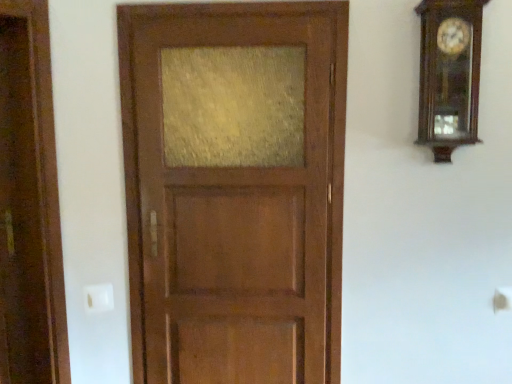
Question: Can you confirm if satin wood door at center is shorter than wooden grandfather clock at upper right?

Choices:
 (A) no
 (B) yes

Answer: (A)

Question: Does satin wood door at center come behind wooden grandfather clock at upper right?

Choices:
 (A) no
 (B) yes

Answer: (B)

Question: Is satin wood door at center in front of wooden grandfather clock at upper right?

Choices:
 (A) no
 (B) yes

Answer: (A)

Question: Does satin wood door at center have a smaller size compared to wooden grandfather clock at upper right?

Choices:
 (A) yes
 (B) no

Answer: (B)

Question: Does satin wood door at center have a lesser width compared to wooden grandfather clock at upper right?

Choices:
 (A) yes
 (B) no

Answer: (A)

Question: From a real-world perspective, is satin wood door at center over wooden grandfather clock at upper right?

Choices:
 (A) no
 (B) yes

Answer: (A)

Question: Is wooden grandfather clock at upper right surrounding satin wood door at center?

Choices:
 (A) no
 (B) yes

Answer: (A)

Question: Could you tell me if wooden grandfather clock at upper right is facing satin wood door at center?

Choices:
 (A) no
 (B) yes

Answer: (A)

Question: From the image's perspective, is wooden grandfather clock at upper right located beneath satin wood door at center?

Choices:
 (A) yes
 (B) no

Answer: (B)

Question: Is wooden grandfather clock at upper right outside satin wood door at center?

Choices:
 (A) no
 (B) yes

Answer: (B)

Question: Considering the relative sizes of wooden grandfather clock at upper right and satin wood door at center in the image provided, is wooden grandfather clock at upper right taller than satin wood door at center?

Choices:
 (A) no
 (B) yes

Answer: (A)

Question: Is wooden grandfather clock at upper right to the left of satin wood door at center from the viewer's perspective?

Choices:
 (A) no
 (B) yes

Answer: (A)

Question: From the image's perspective, is satin wood door at center located above or below wooden grandfather clock at upper right?

Choices:
 (A) below
 (B) above

Answer: (A)